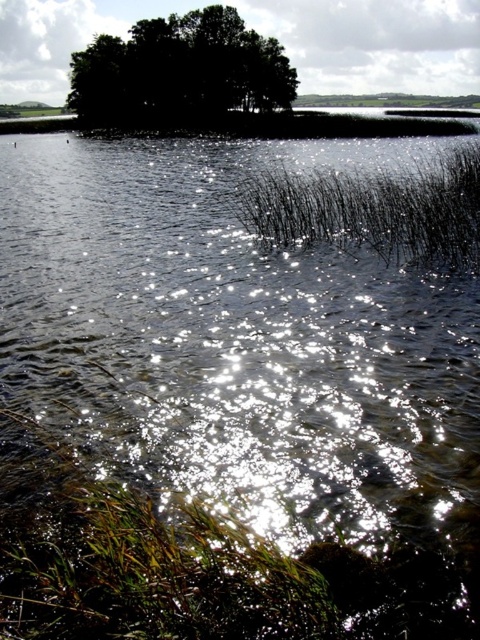
Question: Which point is closer to the camera?

Choices:
 (A) black matte reed at center
 (B) dark green leafy trees at upper center

Answer: (A)

Question: Which point is closer to the camera?

Choices:
 (A) (275, 86)
 (B) (264, 202)

Answer: (B)

Question: Can you confirm if black matte reed at center is bigger than dark green leafy trees at upper center?

Choices:
 (A) no
 (B) yes

Answer: (B)

Question: Is black matte reed at center below dark green leafy trees at upper center?

Choices:
 (A) no
 (B) yes

Answer: (B)

Question: Can you confirm if black matte reed at center is positioned to the left of dark green leafy trees at upper center?

Choices:
 (A) no
 (B) yes

Answer: (A)